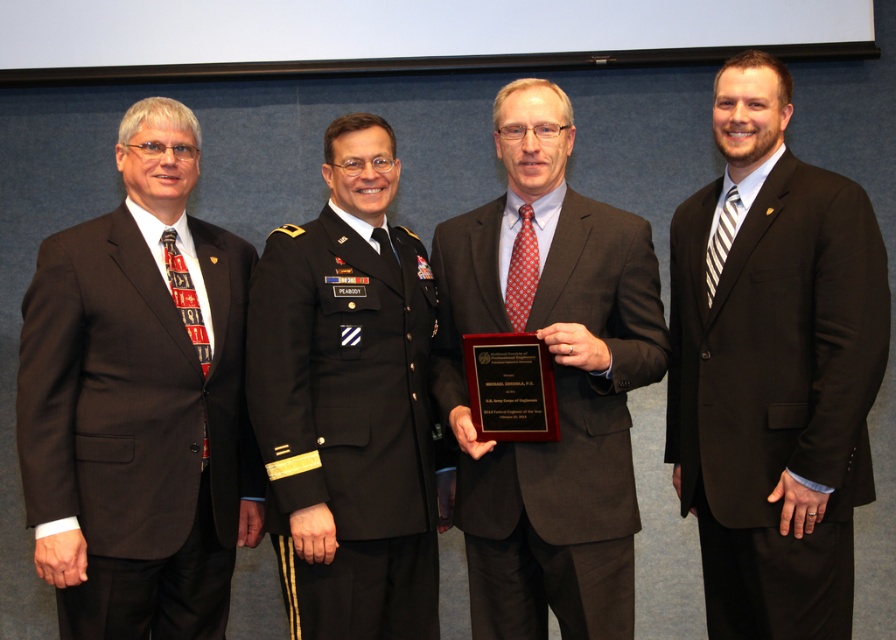
Does brown wool suit at left appear on the left side of black wool military uniform at center?

Yes, brown wool suit at left is to the left of black wool military uniform at center.

Measure the distance between brown wool suit at left and camera.

The distance of brown wool suit at left from camera is 6.52 feet.

Image resolution: width=896 pixels, height=640 pixels. In order to click on brown wool suit at left in this screenshot , I will do `click(134, 404)`.

Does black suit at right appear on the left side of brown wool suit at left?

In fact, black suit at right is to the right of brown wool suit at left.

Can you confirm if black suit at right is wider than brown wool suit at left?

No.

Find the location of a particular element. The width and height of the screenshot is (896, 640). black suit at right is located at coordinates (773, 369).

Can you confirm if black suit at right is positioned above matte black suit at center?

Yes.

Does black suit at right appear under matte black suit at center?

Incorrect, black suit at right is not positioned below matte black suit at center.

The width and height of the screenshot is (896, 640). I want to click on black suit at right, so click(x=773, y=369).